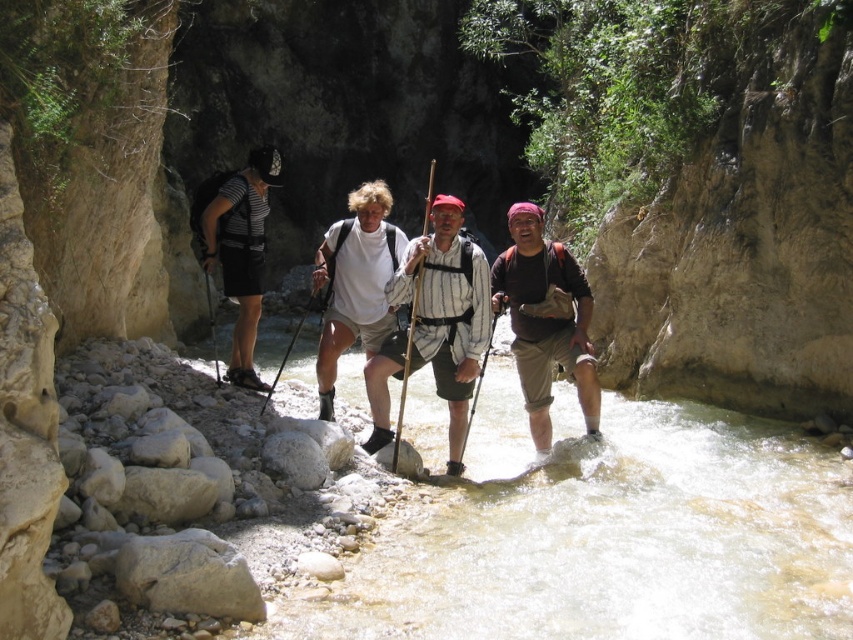
You are a hiker planning to cross the shallow stream in the canyon. You see the striped cotton shirt at center and the matte khaki shorts at center. Which clothing item is closer to the stream?

The striped cotton shirt at center is located above matte khaki shorts at center, so the matte khaki shorts at center is closer to the stream.

Based on the photo, you are planning to take a photo of the striped cotton shirt at center and matte khaki shorts at center. Which item will appear taller in the photo?

The striped cotton shirt at center will appear taller in the photo because it has a greater height compared to the matte khaki shorts at center according to the description.

You are a hiker planning to cross the stream in the canyon. You notice the matte khaki shorts at center and the striped fabric backpack at left. Which item is positioned lower relative to the stream?

The matte khaki shorts at center is below the striped fabric backpack at left, so it is positioned lower relative to the stream.